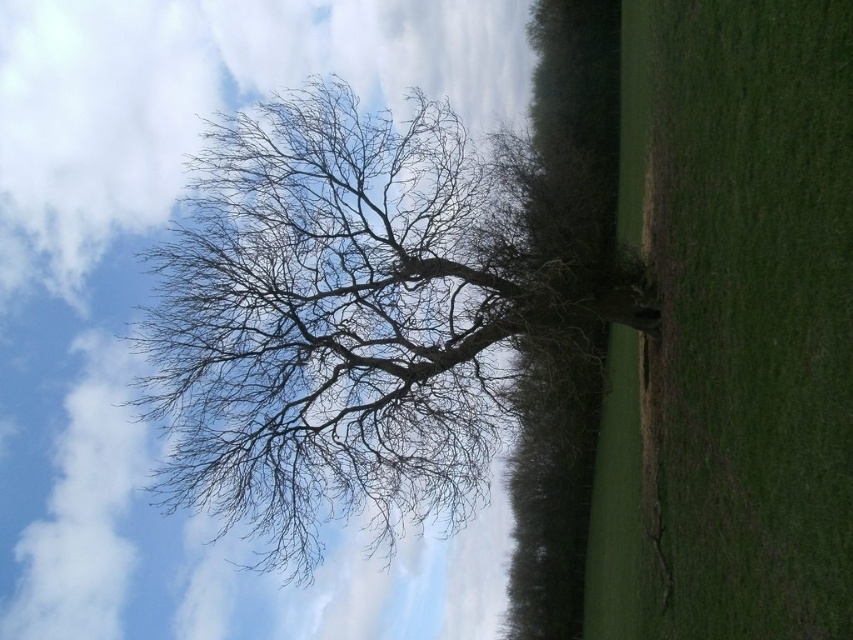
Based on the photo, is bare branches at center above green grassy field at center?

Actually, bare branches at center is below green grassy field at center.

Does bare branches at center have a greater height compared to green grassy field at center?

No, bare branches at center is not taller than green grassy field at center.

Does point (334, 131) come farther from viewer compared to point (619, 524)?

No, it is in front of (619, 524).

The height and width of the screenshot is (640, 853). I want to click on bare branches at center, so click(358, 314).